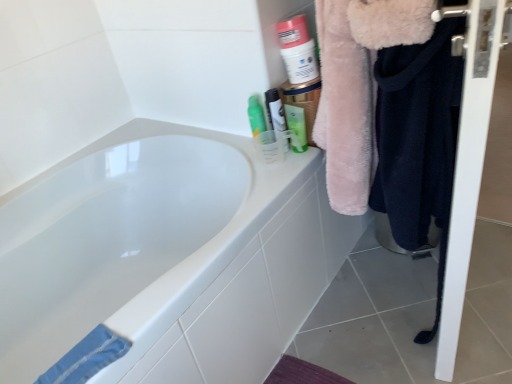
This screenshot has width=512, height=384. In order to click on vacant region below dark blue fleece at right (from a real-world perspective) in this screenshot , I will do `click(402, 304)`.